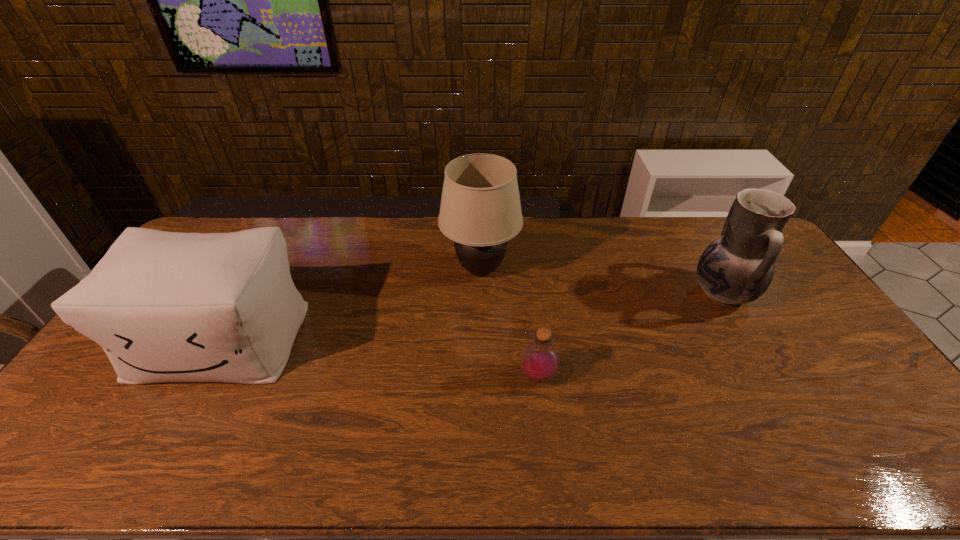
Image resolution: width=960 pixels, height=540 pixels. Find the location of `lampshade`. lampshade is located at coordinates (480, 210).

Locate an element on the screen. The height and width of the screenshot is (540, 960). pitcher is located at coordinates (737, 268).

At what (x,y) coordinates should I click in order to perform the action: click on the leftmost object. Please return your answer as a coordinate pair (x, y). Looking at the image, I should click on (166, 307).

This screenshot has width=960, height=540. Identify the location of the shortest object. (540, 360).

You are a GUI agent. You are given a task and a screenshot of the screen. Output one action in this format:
    pyautogui.click(x=<x>, y=<y>)
    Task: Click on the free space located on the front of the lampshade
    This screenshot has height=540, width=960.
    Given the screenshot: What is the action you would take?
    pyautogui.click(x=481, y=381)

The width and height of the screenshot is (960, 540). Identify the location of blank space located 0.240m on the front-facing side of the rightmost object. (617, 293).

Image resolution: width=960 pixels, height=540 pixels. What are the coordinates of `free spot located on the front-facing side of the rightmost object` in the screenshot? It's located at (589, 293).

Locate an element on the screen. Image resolution: width=960 pixels, height=540 pixels. vacant space located 0.270m on the front-facing side of the rightmost object is located at coordinates (608, 293).

Identify the location of vacant space located 0.200m on the side of the cushion with the smiley face. (152, 464).

You are a GUI agent. You are given a task and a screenshot of the screen. Output one action in this format:
    pyautogui.click(x=<x>, y=<y>)
    Task: Click on the vacant space located on the right of the bottle
    Image resolution: width=960 pixels, height=540 pixels.
    Given the screenshot: What is the action you would take?
    pyautogui.click(x=701, y=376)